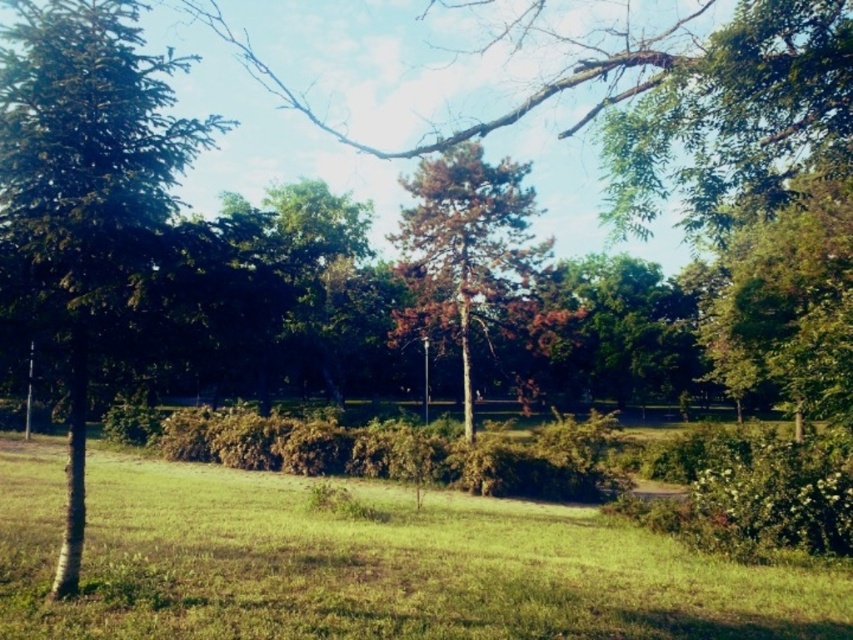
You are planning to place a picnic blanket in the park. The blanket is 2 meters wide. You have two options for placement areas based on the objects in the image. Which area would you choose between the green grassy at lower left and the brown textured tree at center to ensure the blanket fits entirely within the space?

The green grassy at lower left has a larger width than the brown textured tree at center, so placing the picnic blanket there would ensure it fits entirely within the space.

You are standing at the center of the park and want to walk to both the point at coordinates point (53,227) and point (438,182). Which point should you reach first if you walk straight ahead?

You should reach point (53,227) first because it is closer to you than point (438,182).

You are standing at the point marked by coordinates point (367, 563) in the park. Looking around, what do you see immediately below you?

The point (367, 563) corresponds to green grassy at lower left, so you would see green grassy at lower left directly beneath your feet.